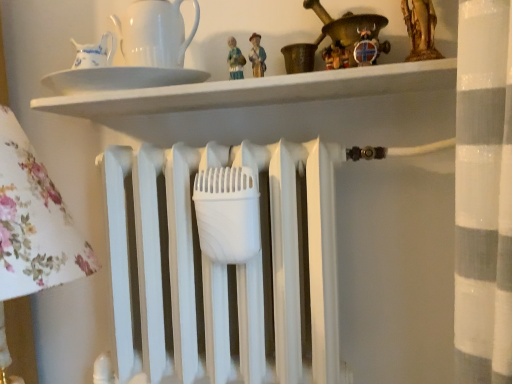
Question: Can you confirm if wooden viking helmet at upper center is positioned to the right of white glossy plate at upper center?

Choices:
 (A) yes
 (B) no

Answer: (A)

Question: Is wooden viking helmet at upper center thinner than white glossy plate at upper center?

Choices:
 (A) no
 (B) yes

Answer: (B)

Question: Can white glossy plate at upper center be found inside wooden viking helmet at upper center?

Choices:
 (A) yes
 (B) no

Answer: (B)

Question: Is wooden viking helmet at upper center smaller than white glossy plate at upper center?

Choices:
 (A) yes
 (B) no

Answer: (A)

Question: Could you tell me if wooden viking helmet at upper center is facing white glossy plate at upper center?

Choices:
 (A) yes
 (B) no

Answer: (B)

Question: Is point (204, 77) closer or farther from the camera than point (345, 52)?

Choices:
 (A) farther
 (B) closer

Answer: (A)

Question: Choose the correct answer: Is white glossy pitcher at upper left inside wooden viking helmet at upper center or outside it?

Choices:
 (A) inside
 (B) outside

Answer: (B)

Question: Is white glossy pitcher at upper left wider or thinner than wooden viking helmet at upper center?

Choices:
 (A) thin
 (B) wide

Answer: (A)

Question: From a real-world perspective, is white glossy pitcher at upper left positioned above or below wooden viking helmet at upper center?

Choices:
 (A) above
 (B) below

Answer: (A)

Question: Considering the positions of wooden viking helmet at upper center and white glossy plate at upper center in the image, is wooden viking helmet at upper center taller or shorter than white glossy plate at upper center?

Choices:
 (A) tall
 (B) short

Answer: (A)

Question: Which is correct: wooden viking helmet at upper center is inside white glossy plate at upper center, or outside of it?

Choices:
 (A) inside
 (B) outside

Answer: (B)

Question: Is wooden viking helmet at upper center in front of or behind white glossy plate at upper center in the image?

Choices:
 (A) front
 (B) behind

Answer: (B)

Question: Visually, is wooden viking helmet at upper center positioned to the left or to the right of white glossy plate at upper center?

Choices:
 (A) left
 (B) right

Answer: (B)

Question: Based on their sizes in the image, would you say white glossy plate at upper center is bigger or smaller than wooden viking helmet at upper center?

Choices:
 (A) big
 (B) small

Answer: (A)

Question: In terms of width, does white glossy plate at upper center look wider or thinner when compared to wooden viking helmet at upper center?

Choices:
 (A) wide
 (B) thin

Answer: (A)